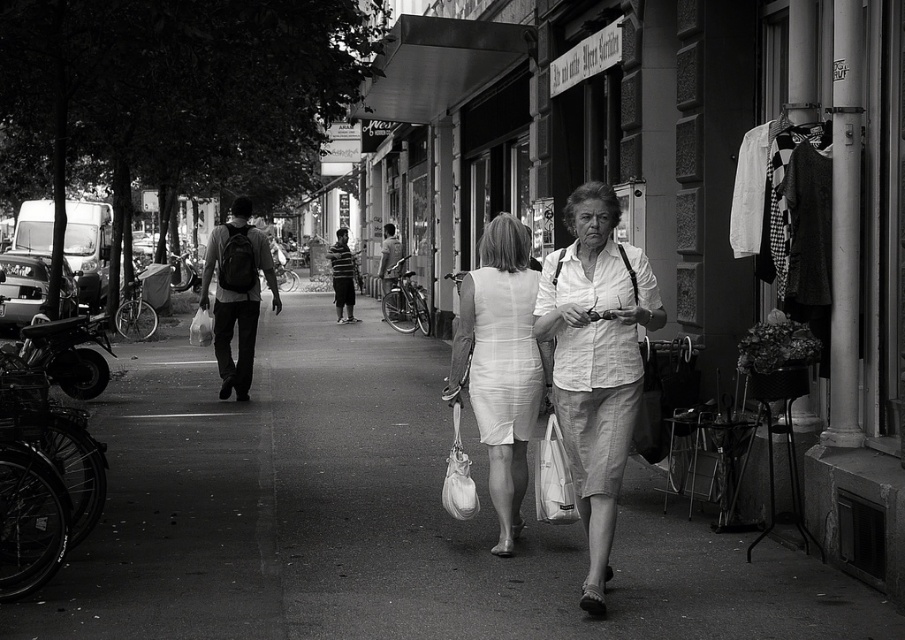
The height and width of the screenshot is (640, 905). What do you see at coordinates (377, 520) in the screenshot?
I see `smooth asphalt pavement at center` at bounding box center [377, 520].

Is smooth asphalt pavement at center taller than matte black backpack at center?

Incorrect, smooth asphalt pavement at center's height is not larger of matte black backpack at center's.

Measure the distance between point [143,467] and camera.

Point [143,467] and camera are 25.72 feet apart.

Find the location of a particular element. Image resolution: width=905 pixels, height=640 pixels. smooth asphalt pavement at center is located at coordinates (377, 520).

Between white textured dress at center and matte black backpack at left, which one appears on the right side from the viewer's perspective?

From the viewer's perspective, white textured dress at center appears more on the right side.

Does white textured dress at center have a lesser width compared to matte black backpack at left?

Correct, white textured dress at center's width is less than matte black backpack at left's.

Between point (475, 413) and point (216, 346), which one is positioned in front?

Point (475, 413)

Locate an element on the screen. white textured dress at center is located at coordinates (500, 364).

Between point (543, 262) and point (507, 260), which one is positioned in front?

Point (507, 260)

I want to click on white cotton dress at center, so click(596, 360).